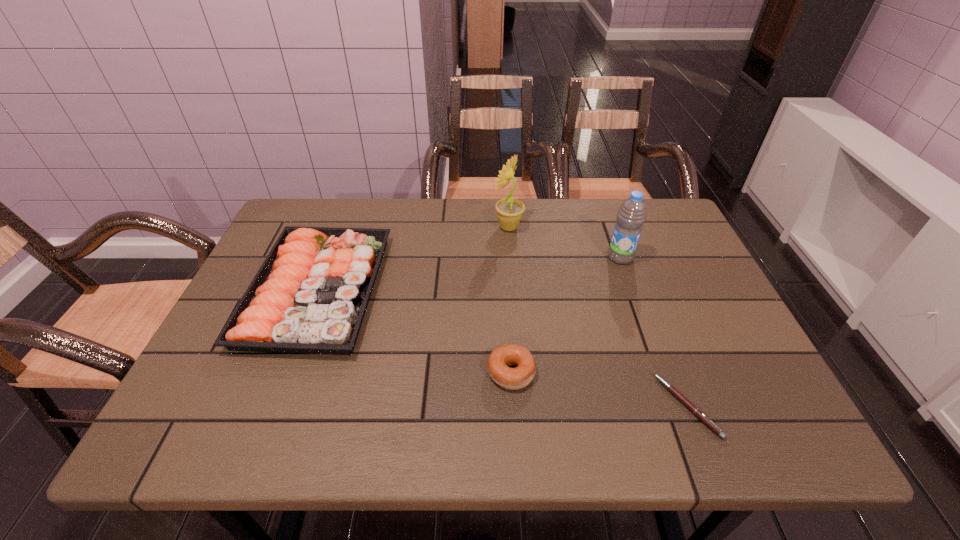
Locate an element on the screen. sunflower is located at coordinates (509, 211).

The image size is (960, 540). What are the coordinates of `water bottle` in the screenshot? It's located at (631, 216).

The height and width of the screenshot is (540, 960). Identify the location of the leftmost object. (310, 295).

The image size is (960, 540). What are the coordinates of `platter` in the screenshot? It's located at (310, 295).

This screenshot has width=960, height=540. Find the location of `bagel`. bagel is located at coordinates (501, 357).

Locate an element on the screen. This screenshot has width=960, height=540. pen is located at coordinates (697, 412).

The width and height of the screenshot is (960, 540). I want to click on vacant space situated 0.110m on the face of the sunflower, so click(x=457, y=227).

The image size is (960, 540). In order to click on vacant position located on the face of the sunflower in this screenshot , I will do `click(467, 227)`.

Identify the location of vacant region located 0.400m on the face of the sunflower. This screenshot has width=960, height=540. (360, 227).

I want to click on vacant point located 0.350m on the front of the water bottle, so click(x=662, y=376).